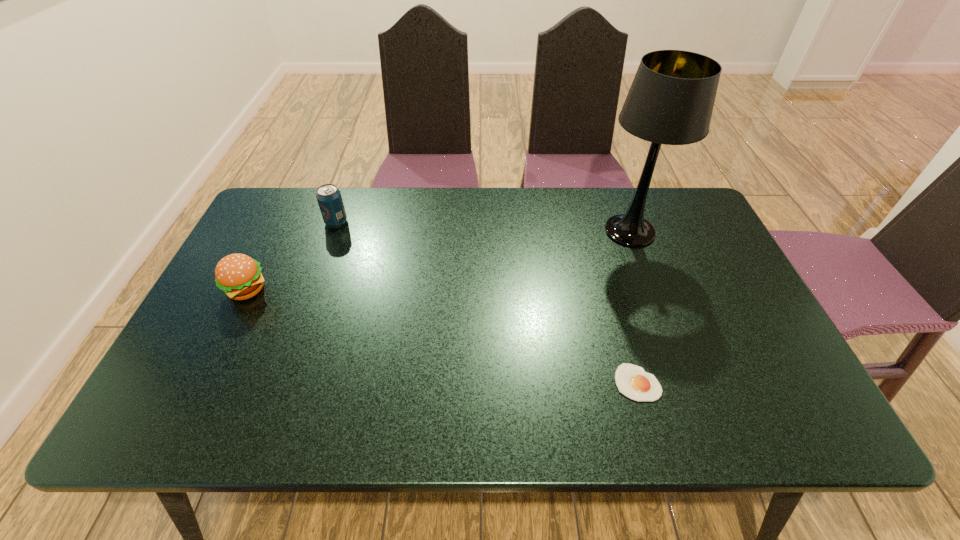
Locate an element on the screen. This screenshot has height=540, width=960. the tallest object is located at coordinates (671, 99).

You are a GUI agent. You are given a task and a screenshot of the screen. Output one action in this format:
    pyautogui.click(x=<x>, y=<y>)
    Task: Click on the pop soda
    This screenshot has width=960, height=540.
    Given the screenshot: What is the action you would take?
    (329, 198)

You are a GUI agent. You are given a task and a screenshot of the screen. Output one action in this format:
    pyautogui.click(x=<x>, y=<y>)
    Task: Click on the third farthest object
    
    Given the screenshot: What is the action you would take?
    pyautogui.click(x=238, y=275)

You are a GUI agent. You are given a task and a screenshot of the screen. Output one action in this format:
    pyautogui.click(x=<x>, y=<y>)
    Task: Click on the hamburger
    This screenshot has height=540, width=960.
    Given the screenshot: What is the action you would take?
    pyautogui.click(x=238, y=275)

The image size is (960, 540). I want to click on the nearest object, so click(x=631, y=380).

Locate an element on the screen. This screenshot has height=540, width=960. egg yolk is located at coordinates (631, 380).

At what (x,y) coordinates should I click in order to perform the action: click on vacant point located on the front of the table lamp. Please return your answer as a coordinate pair (x, y). The width and height of the screenshot is (960, 540). Looking at the image, I should click on (646, 276).

Find the location of a particular element. The width and height of the screenshot is (960, 540). blank area located on the right of the second object from left to right is located at coordinates (466, 222).

At what (x,y) coordinates should I click in order to perform the action: click on vacant space located 0.280m on the front of the third farthest object. Please return your answer as a coordinate pair (x, y). The width and height of the screenshot is (960, 540). Looking at the image, I should click on (188, 410).

This screenshot has height=540, width=960. I want to click on vacant region located on the front of the shortest object, so click(x=652, y=434).